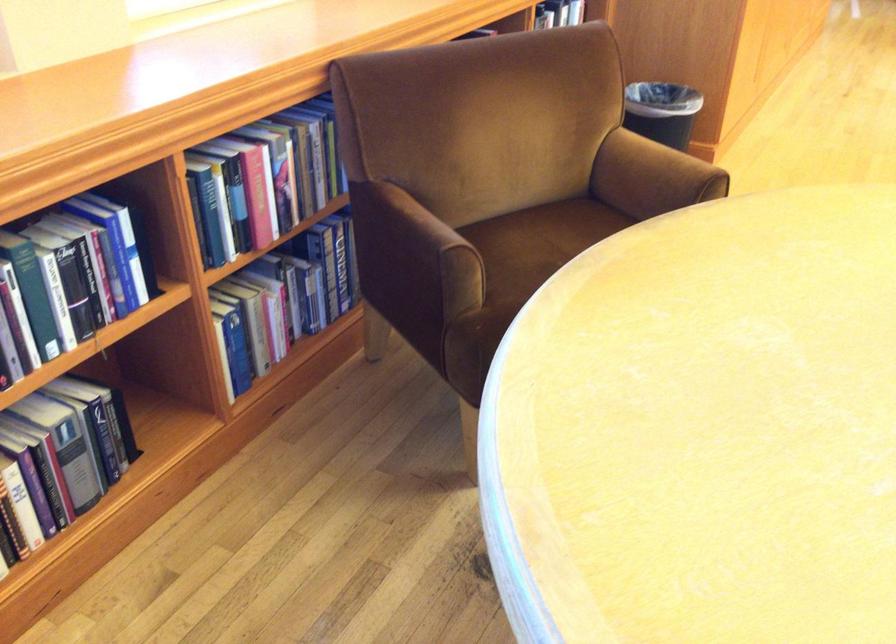
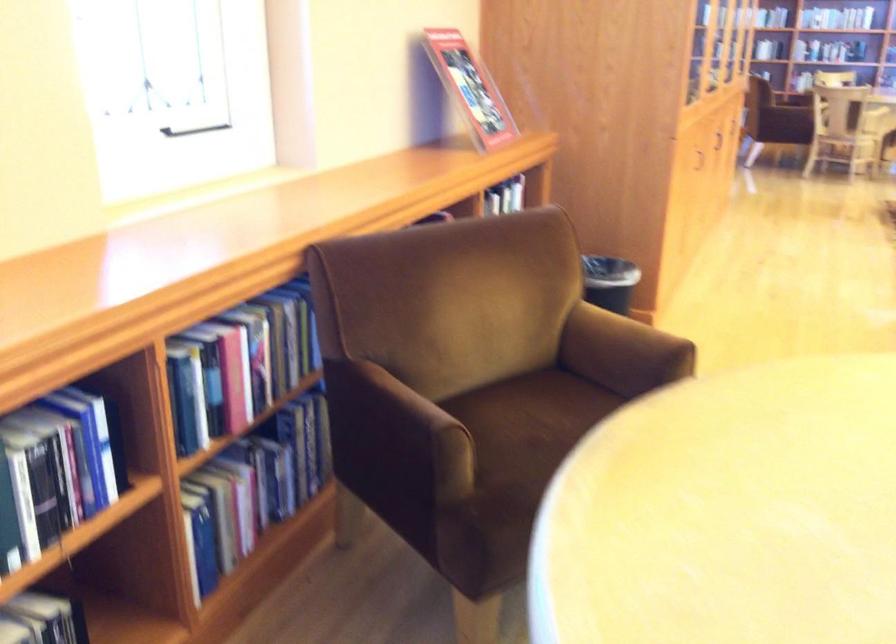
Question: The first image is from the beginning of the video and the second image is from the end. How did the camera likely rotate when shooting the video?

Choices:
 (A) Left
 (B) Right
 (C) Up
 (D) Down

Answer: (C)